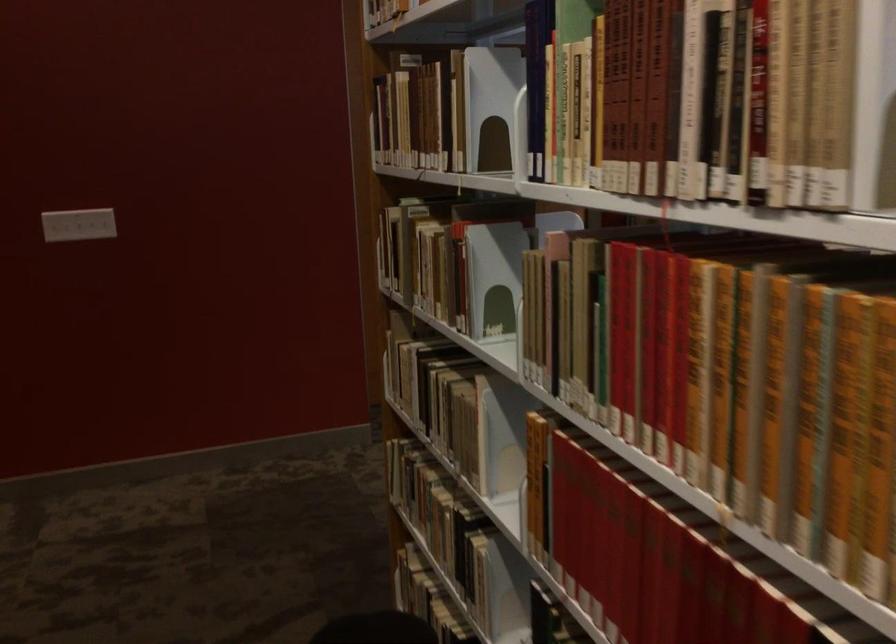
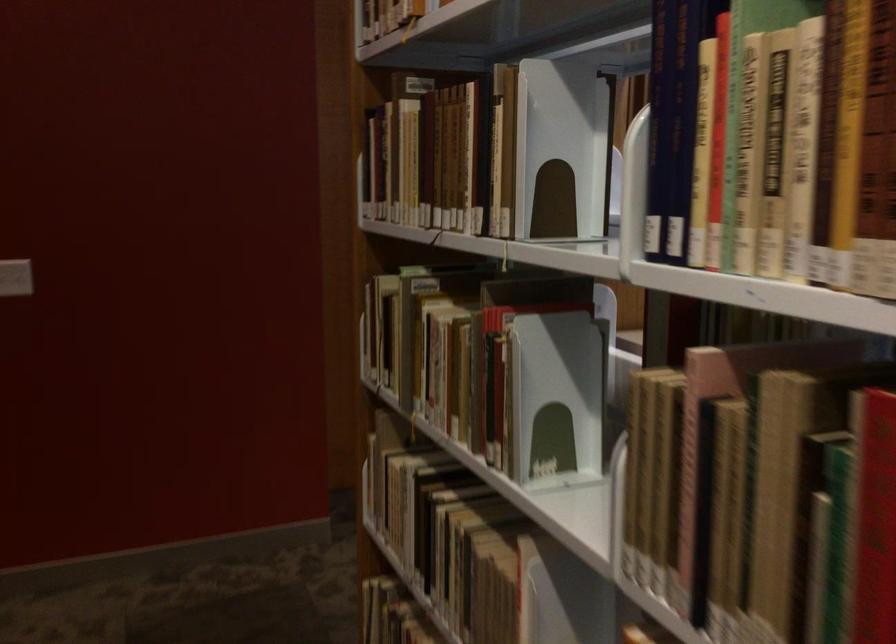
In the second image, find the point that corresponds to (99,219) in the first image.

(15, 277)